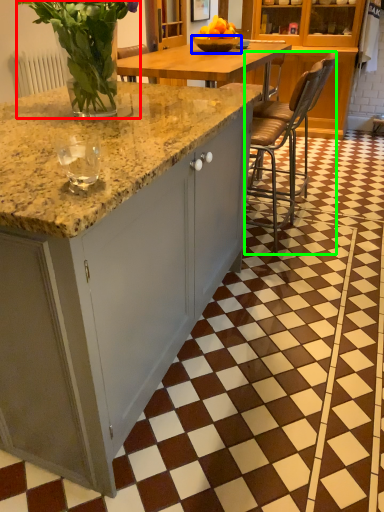
Question: Which is farther away from floral arrangement (highlighted by a red box)? bowl (highlighted by a blue box) or chair (highlighted by a green box)?

Choices:
 (A) bowl
 (B) chair

Answer: (B)